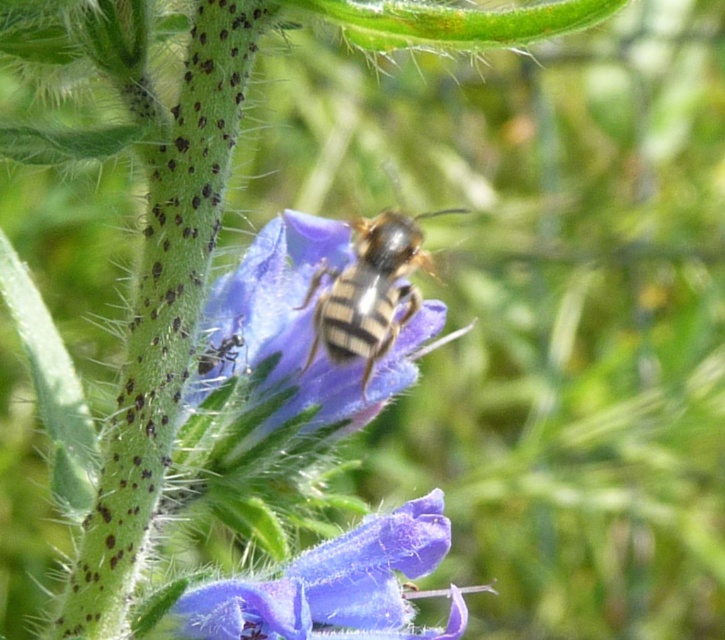
Question: Is smooth purple petal at center thinner than purple matte flower at center?

Choices:
 (A) no
 (B) yes

Answer: (A)

Question: Does smooth purple petal at center have a lesser width compared to purple matte flower at center?

Choices:
 (A) no
 (B) yes

Answer: (A)

Question: Among these points, which one is nearest to the camera?

Choices:
 (A) (362, 257)
 (B) (269, 627)

Answer: (B)

Question: Which object appears closest to the camera in this image?

Choices:
 (A) purple matte flower at center
 (B) striped fur bee at center
 (C) smooth purple petal at center

Answer: (A)

Question: From the image, what is the correct spatial relationship of purple matte flower at center in relation to striped fur bee at center?

Choices:
 (A) below
 (B) above

Answer: (A)

Question: Which point appears closest to the camera in this image?

Choices:
 (A) (447, 547)
 (B) (219, 380)
 (C) (304, 305)

Answer: (A)